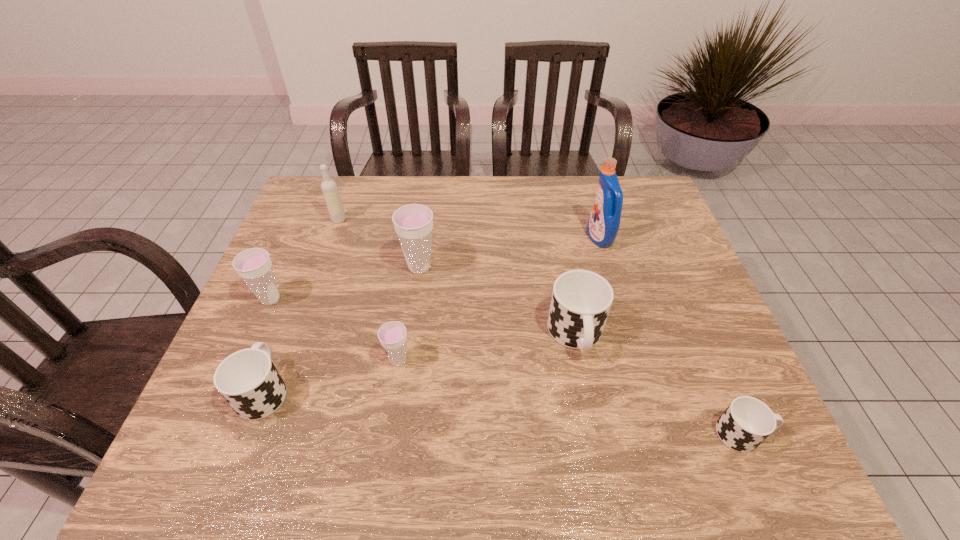
You are a GUI agent. You are given a task and a screenshot of the screen. Output one action in this format:
    pyautogui.click(x=<x>, y=<y>)
    Task: Click on the object situated at the near right corner
    
    Given the screenshot: What is the action you would take?
    pyautogui.click(x=747, y=422)

Image resolution: width=960 pixels, height=540 pixels. What are the coordinates of `free space at the far edge of the desktop` in the screenshot? It's located at (530, 189).

Find the location of a particular element. The image size is (960, 540). free space at the near edge of the desktop is located at coordinates (365, 448).

In the image, there is a desktop. Identify the location of free space at the right edge. Image resolution: width=960 pixels, height=540 pixels. (680, 284).

Locate an element on the screen. Image resolution: width=960 pixels, height=540 pixels. vacant area at the far left corner is located at coordinates (301, 215).

At what (x,y) coordinates should I click in order to perform the action: click on vacant region at the far right corner. Please return your answer as a coordinate pair (x, y). Image resolution: width=960 pixels, height=540 pixels. Looking at the image, I should click on (623, 176).

Locate an element on the screen. This screenshot has width=960, height=540. free space between the second object from right to left and the leftmost black cup is located at coordinates (432, 314).

Find the location of a particular element. This screenshot has width=960, height=540. vacant space in between the farthest object and the second biggest black cup is located at coordinates (301, 305).

Find the location of a particular element. free space that is in between the biggest purple cup and the second nearest purple cup is located at coordinates (345, 283).

Locate an element on the screen. This screenshot has width=960, height=540. free space that is in between the second farthest purple cup and the third object from right to left is located at coordinates (423, 317).